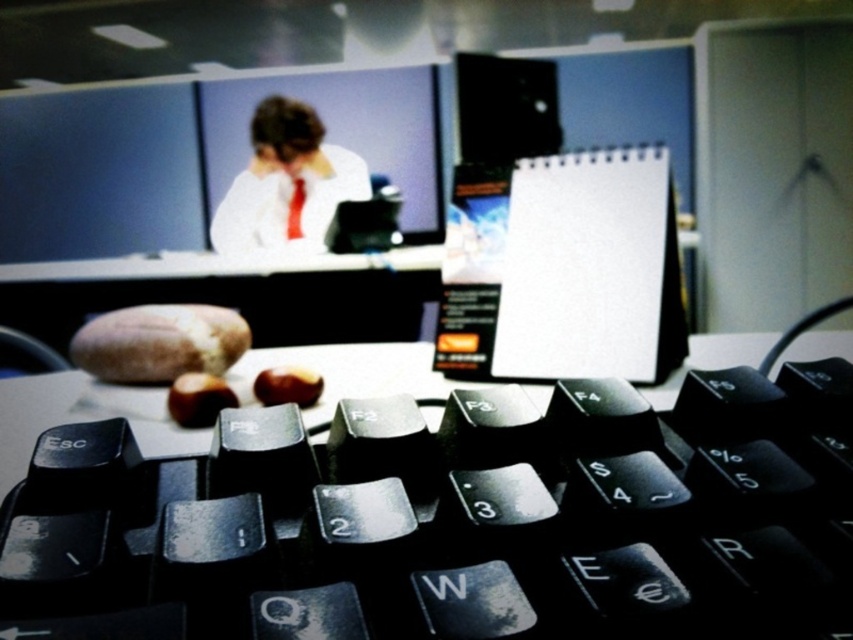
Question: Among these objects, which one is farthest from the camera?

Choices:
 (A) matte red tie at center
 (B) white glossy shirt at upper center

Answer: (A)

Question: Is white glossy shirt at upper center below matte red tie at center?

Choices:
 (A) no
 (B) yes

Answer: (A)

Question: Is black plastic keyboard at lower center above matte red tie at center?

Choices:
 (A) yes
 (B) no

Answer: (B)

Question: Among these objects, which one is nearest to the camera?

Choices:
 (A) white glossy shirt at upper center
 (B) matte red tie at center

Answer: (A)

Question: Is black glossy monitor at upper center in front of matte red tie at center?

Choices:
 (A) no
 (B) yes

Answer: (B)

Question: Which of these objects is positioned closest to the white glossy shirt at upper center?

Choices:
 (A) black glossy monitor at upper center
 (B) matte red tie at center

Answer: (B)